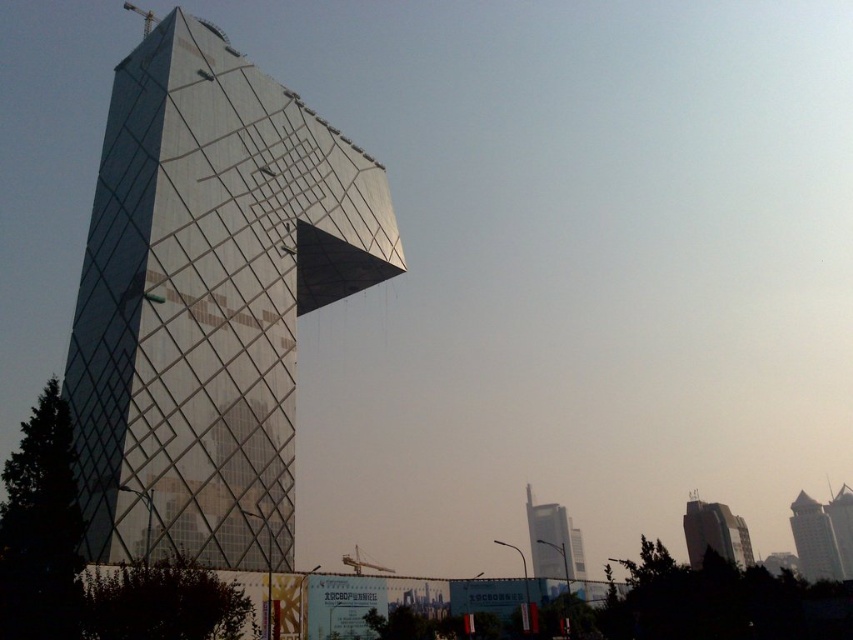
Which is behind, point (579, 564) or point (796, 522)?

Positioned behind is point (796, 522).

Is point (570, 570) positioned behind point (808, 564)?

No.

Where is `glassy silver skyscraper at center`? Image resolution: width=853 pixels, height=640 pixels. glassy silver skyscraper at center is located at coordinates (553, 541).

Looking at this image, is metallic glass tower at center positioned before silver glass skyscraper at center?

Yes, it is in front of silver glass skyscraper at center.

Can you confirm if metallic glass tower at center is wider than silver glass skyscraper at center?

Yes.

Is point (225, 490) positioned after point (813, 577)?

That is False.

This screenshot has width=853, height=640. Identify the location of metallic glass tower at center. (207, 298).

Can you confirm if metallic glass tower at center is thinner than glassy silver skyscraper at center?

No.

Is metallic glass tower at center wider than glassy silver skyscraper at center?

Yes.

Is point (107, 428) farther from viewer compared to point (579, 564)?

No, (107, 428) is in front of (579, 564).

At what (x,y) coordinates should I click in order to perform the action: click on metallic glass tower at center. Please return your answer as a coordinate pair (x, y). The image size is (853, 640). Looking at the image, I should click on (207, 298).